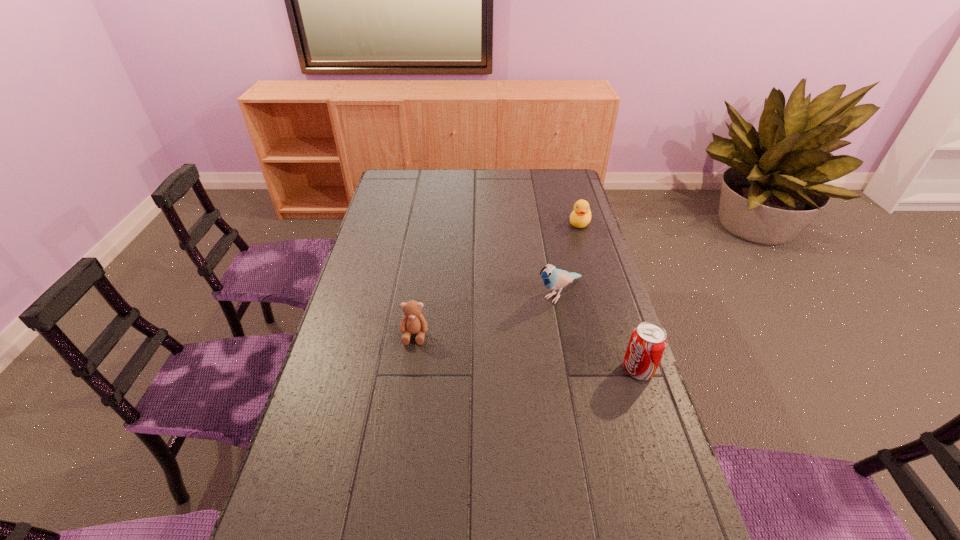
Identify the location of vacant space located at the face of the third object from right to left. The image size is (960, 540). (464, 367).

The height and width of the screenshot is (540, 960). What are the coordinates of `free space located on the face of the farthest object` in the screenshot? It's located at (549, 294).

This screenshot has width=960, height=540. What are the coordinates of `vacant position located 0.140m on the face of the farthest object` in the screenshot? It's located at (569, 251).

I want to click on free space located on the face of the farthest object, so click(569, 251).

The width and height of the screenshot is (960, 540). Find the location of `soda that is at the right edge`. soda that is at the right edge is located at coordinates (647, 344).

Where is `bird that is at the right edge`? The height and width of the screenshot is (540, 960). bird that is at the right edge is located at coordinates (553, 278).

The height and width of the screenshot is (540, 960). I want to click on duckling present at the right edge, so click(x=580, y=217).

Find the location of a particular element. vacant space at the far edge of the desktop is located at coordinates (490, 182).

In the image, there is a desktop. In order to click on free space at the left edge in this screenshot , I will do `click(368, 274)`.

At what (x,y) coordinates should I click in order to perform the action: click on vacant region at the right edge of the desktop. Please return your answer as a coordinate pair (x, y). This screenshot has width=960, height=540. Looking at the image, I should click on (649, 468).